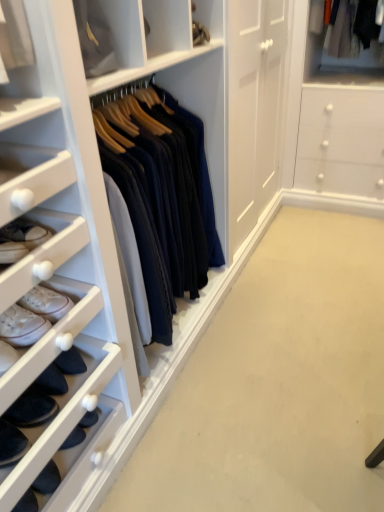
Question: Is dark blue suede shoe at lower left, placed as the 1th footwear when sorted from bottom to top, not close to white leather sneakers at lower left, arranged as the second footwear when ordered from the bottom?

Choices:
 (A) no
 (B) yes

Answer: (A)

Question: Considering the relative positions of dark blue suede shoe at lower left, placed as the 1th footwear when sorted from bottom to top, and white leather sneakers at lower left, arranged as the second footwear when ordered from the bottom, in the image provided, is dark blue suede shoe at lower left, placed as the 1th footwear when sorted from bottom to top, to the right of white leather sneakers at lower left, arranged as the second footwear when ordered from the bottom, from the viewer's perspective?

Choices:
 (A) no
 (B) yes

Answer: (A)

Question: Can you confirm if dark blue suede shoe at lower left, placed as the 1th footwear when sorted from bottom to top, is wider than white leather sneakers at lower left, arranged as the second footwear when ordered from the bottom?

Choices:
 (A) no
 (B) yes

Answer: (B)

Question: Is dark blue suede shoe at lower left, placed as the 1th footwear when sorted from bottom to top, smaller than white leather sneakers at lower left, arranged as the second footwear when ordered from the bottom?

Choices:
 (A) yes
 (B) no

Answer: (B)

Question: Is dark blue suede shoe at lower left, placed as the 1th footwear when sorted from bottom to top, with white leather sneakers at lower left, arranged as the second footwear when ordered from the bottom?

Choices:
 (A) yes
 (B) no

Answer: (B)

Question: Considering the relative positions of dark blue suede shoe at lower left, which is counted as the 2th footwear, starting from the top, and white leather sneakers at lower left, arranged as the second footwear when ordered from the bottom, in the image provided, is dark blue suede shoe at lower left, which is counted as the 2th footwear, starting from the top, behind white leather sneakers at lower left, arranged as the second footwear when ordered from the bottom,?

Choices:
 (A) no
 (B) yes

Answer: (A)

Question: Is white leather sneakers at lower left, arranged as the second footwear when ordered from the bottom, to the left of dark blue suede shoe at lower left, which is counted as the 2th footwear, starting from the top, from the viewer's perspective?

Choices:
 (A) no
 (B) yes

Answer: (A)

Question: Can we say white leather sneakers at lower left, arranged as the second footwear when ordered from the bottom, lies outside dark blue suede shoe at lower left, which is counted as the 2th footwear, starting from the top?

Choices:
 (A) no
 (B) yes

Answer: (B)

Question: Does white leather sneakers at lower left, arranged as the 1th footwear when viewed from the top, have a larger size compared to dark blue suede shoe at lower left, placed as the 1th footwear when sorted from bottom to top?

Choices:
 (A) no
 (B) yes

Answer: (A)

Question: Considering the relative sizes of white leather sneakers at lower left, arranged as the 1th footwear when viewed from the top, and dark blue suede shoe at lower left, placed as the 1th footwear when sorted from bottom to top, in the image provided, is white leather sneakers at lower left, arranged as the 1th footwear when viewed from the top, wider than dark blue suede shoe at lower left, placed as the 1th footwear when sorted from bottom to top,?

Choices:
 (A) no
 (B) yes

Answer: (A)

Question: Are white leather sneakers at lower left, arranged as the second footwear when ordered from the bottom, and dark blue suede shoe at lower left, which is counted as the 2th footwear, starting from the top, far apart?

Choices:
 (A) yes
 (B) no

Answer: (B)

Question: Considering the relative positions of white leather sneakers at lower left, arranged as the second footwear when ordered from the bottom, and dark blue suede shoe at lower left, placed as the 1th footwear when sorted from bottom to top, in the image provided, is white leather sneakers at lower left, arranged as the second footwear when ordered from the bottom, to the right of dark blue suede shoe at lower left, placed as the 1th footwear when sorted from bottom to top, from the viewer's perspective?

Choices:
 (A) yes
 (B) no

Answer: (A)

Question: Considering the relative sizes of dark blue suede shoe at lower left, placed as the 1th footwear when sorted from bottom to top, and matte white cabinet at upper center in the image provided, is dark blue suede shoe at lower left, placed as the 1th footwear when sorted from bottom to top, shorter than matte white cabinet at upper center?

Choices:
 (A) no
 (B) yes

Answer: (B)